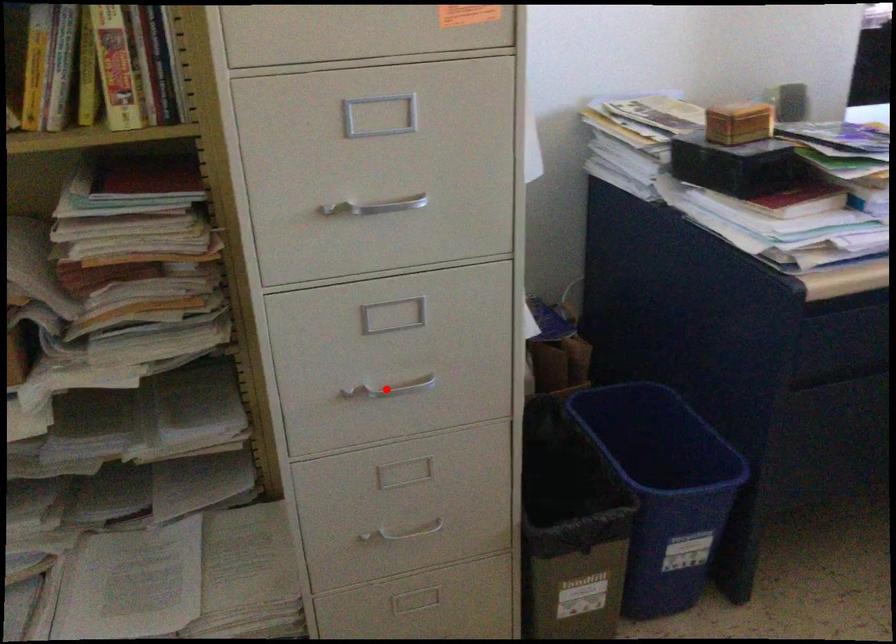
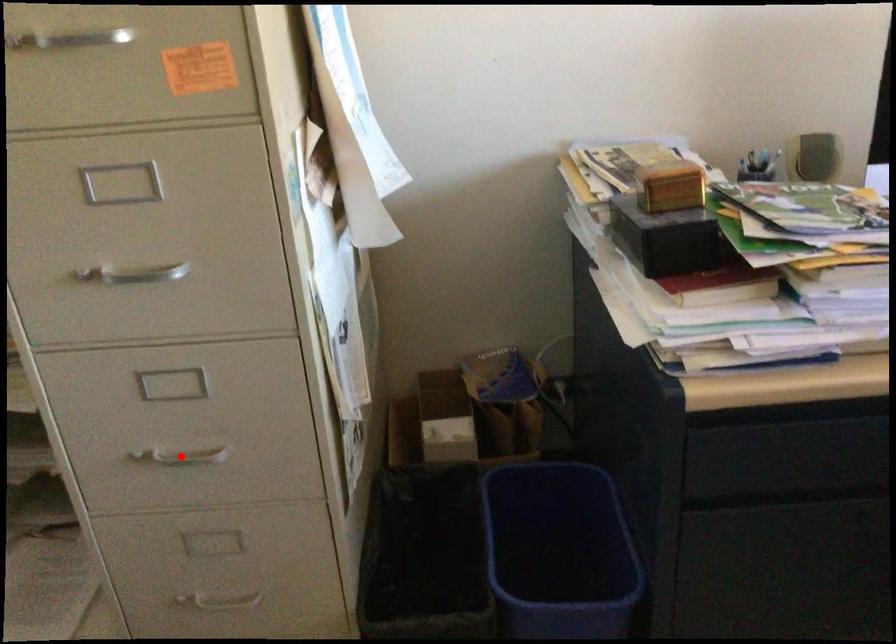
I am providing you with two images of the same scene from different viewpoints. A red point is marked on the first image and another point is marked on the second image. Is the red point in image1 aligned with the point shown in image2?

Yes